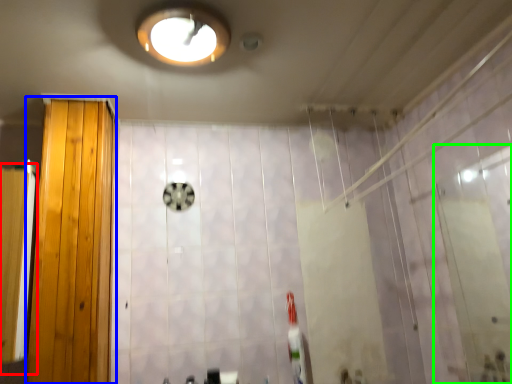
Question: Which object is positioned farthest from screen door (highlighted by a red box)? Select from door (highlighted by a blue box) and screen door (highlighted by a green box).

Choices:
 (A) door
 (B) screen door

Answer: (B)